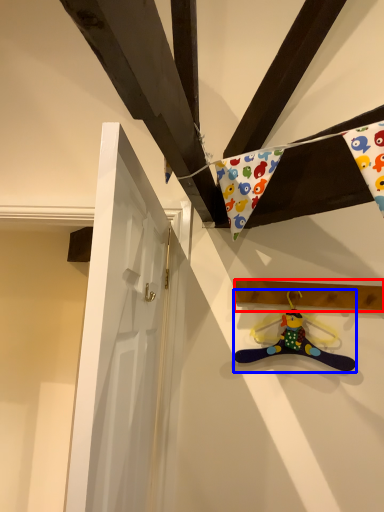
Question: Which object is closer to the camera taking this photo, plank (highlighted by a red box) or toy (highlighted by a blue box)?

Choices:
 (A) plank
 (B) toy

Answer: (B)